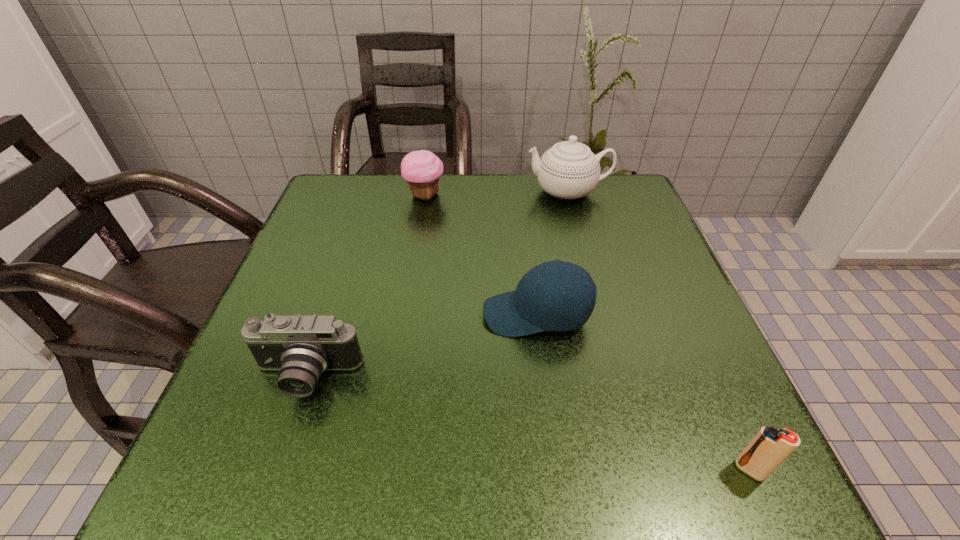
Where is `the tallest object`? The width and height of the screenshot is (960, 540). the tallest object is located at coordinates (569, 170).

Locate an element on the screen. Image resolution: width=960 pixels, height=540 pixels. the second object from left to right is located at coordinates (422, 169).

At what (x,y) coordinates should I click in order to perform the action: click on baseball cap. Please return your answer as a coordinate pair (x, y). The height and width of the screenshot is (540, 960). Looking at the image, I should click on (538, 304).

I want to click on the leftmost object, so click(302, 347).

This screenshot has height=540, width=960. I want to click on the fourth farthest object, so click(x=302, y=347).

This screenshot has width=960, height=540. I want to click on igniter, so 770,447.

Locate an element on the screen. This screenshot has height=540, width=960. the nearest object is located at coordinates (770, 447).

The width and height of the screenshot is (960, 540). I want to click on vacant space located 0.180m on the spout of the tallest object, so click(x=456, y=192).

Find the location of `vacant space situated 0.390m on the spout of the tallest object`. vacant space situated 0.390m on the spout of the tallest object is located at coordinates (x=374, y=192).

The width and height of the screenshot is (960, 540). Find the location of `vacant space located on the spout of the tallest object`. vacant space located on the spout of the tallest object is located at coordinates (390, 192).